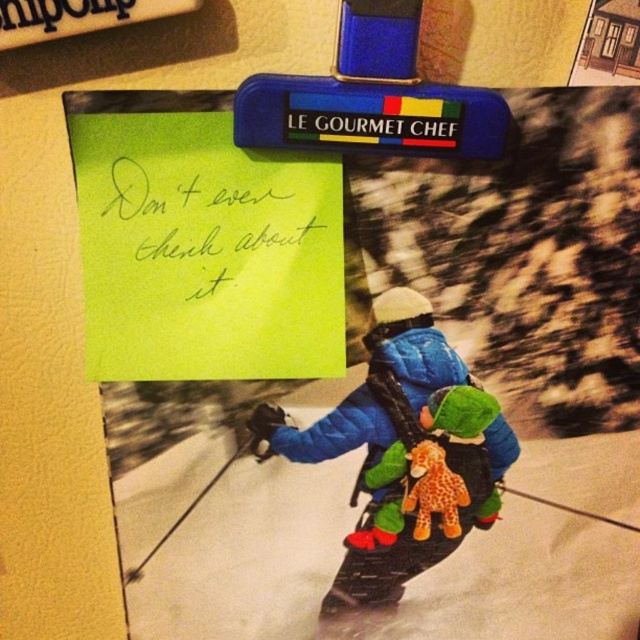
Does blue quilted jacket at center appear on the left side of soft plush giraffe at center?

Correct, you'll find blue quilted jacket at center to the left of soft plush giraffe at center.

Does blue quilted jacket at center appear under soft plush giraffe at center?

Actually, blue quilted jacket at center is above soft plush giraffe at center.

Does point (394, 435) come farther from viewer compared to point (419, 497)?

No, it is in front of (419, 497).

This screenshot has height=640, width=640. I want to click on blue quilted jacket at center, so click(x=403, y=452).

Between blue quilted jacket at center and yellow paper at upper left, which one is positioned lower?

blue quilted jacket at center is lower down.

Which is behind, point (403, 534) or point (214, 218)?

The point (403, 534) is more distant.

What do you see at coordinates (403, 452) in the screenshot? The width and height of the screenshot is (640, 640). I see `blue quilted jacket at center` at bounding box center [403, 452].

Identify the location of blue quilted jacket at center. (403, 452).

Who is more forward, (211, 240) or (417, 460)?

Point (211, 240) is in front.

Between yellow paper at upper left and soft plush giraffe at center, which one is positioned lower?

soft plush giraffe at center is below.

Who is more distant from viewer, (x=195, y=225) or (x=456, y=496)?

Point (x=456, y=496)

Where is `yellow paper at upper left`? yellow paper at upper left is located at coordinates (216, 227).